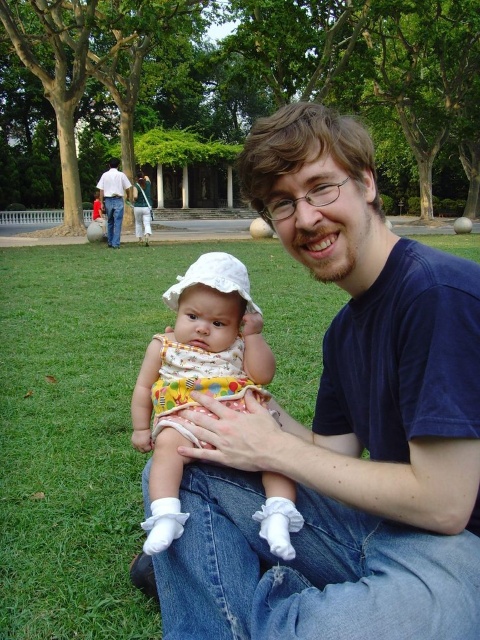
You are a photographer setting up for a family photo. You notice the printed cotton dress at center and denim jeans at center in the scene. Which clothing item is wider?

The printed cotton dress at center is narrower than the denim jeans at center, so the denim jeans at center is wider.

You are a photographer taking a photo of the blue cotton shirt at center and the printed cotton dress at center. Which one should you focus on if you want to capture the taller object?

The blue cotton shirt at center is taller than the printed cotton dress at center, so you should focus on the blue cotton shirt at center to capture the taller object.